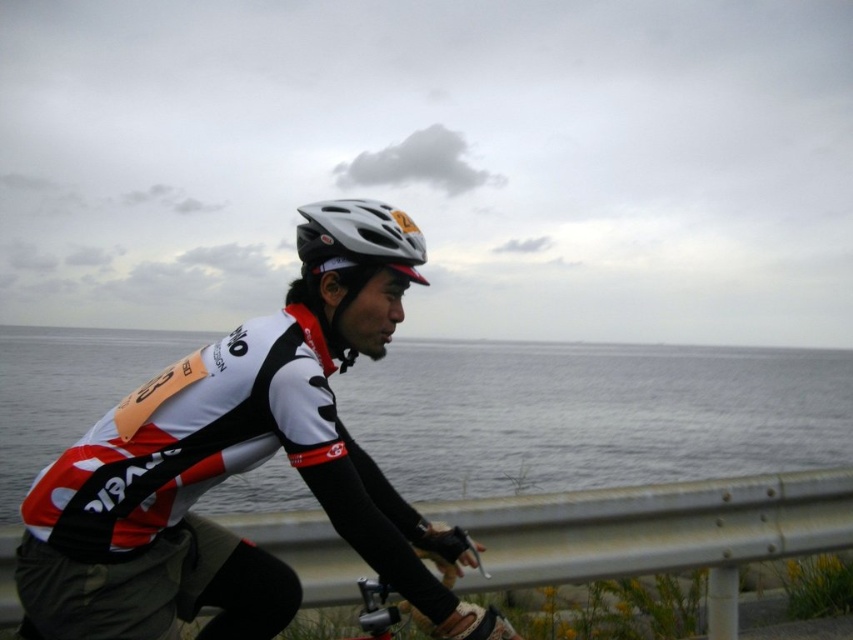
Is matte black helmet at center above metallic silver bicycle at lower center?

Indeed, matte black helmet at center is positioned over metallic silver bicycle at lower center.

Does point (183, 620) come in front of point (380, 596)?

No, it is behind (380, 596).

This screenshot has height=640, width=853. I want to click on matte black helmet at center, so click(x=241, y=465).

Based on the photo, is transparent water at center below metallic silver bicycle at lower center?

Correct, transparent water at center is located below metallic silver bicycle at lower center.

Can you confirm if transparent water at center is positioned to the left of metallic silver bicycle at lower center?

In fact, transparent water at center is to the right of metallic silver bicycle at lower center.

You are a GUI agent. You are given a task and a screenshot of the screen. Output one action in this format:
    pyautogui.click(x=<x>, y=<y>)
    Task: Click on the transparent water at center
    The image size is (853, 640).
    Given the screenshot: What is the action you would take?
    pyautogui.click(x=592, y=413)

Looking at this image, does transparent water at center come behind white matte bicycle helmet at center?

Yes.

Is transparent water at center bigger than white matte bicycle helmet at center?

Yes.

Between point (790, 381) and point (392, 225), which one is positioned behind?

The point (790, 381) is more distant.

At what (x,y) coordinates should I click in order to perform the action: click on transparent water at center. Please return your answer as a coordinate pair (x, y). The width and height of the screenshot is (853, 640). Looking at the image, I should click on (592, 413).